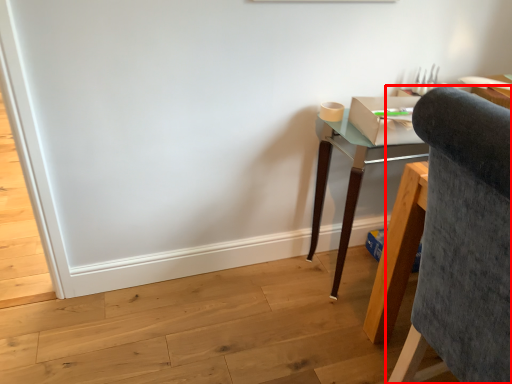
Question: From the image's perspective, where is chair (annotated by the red box) located in relation to desk in the image?

Choices:
 (A) below
 (B) above

Answer: (A)